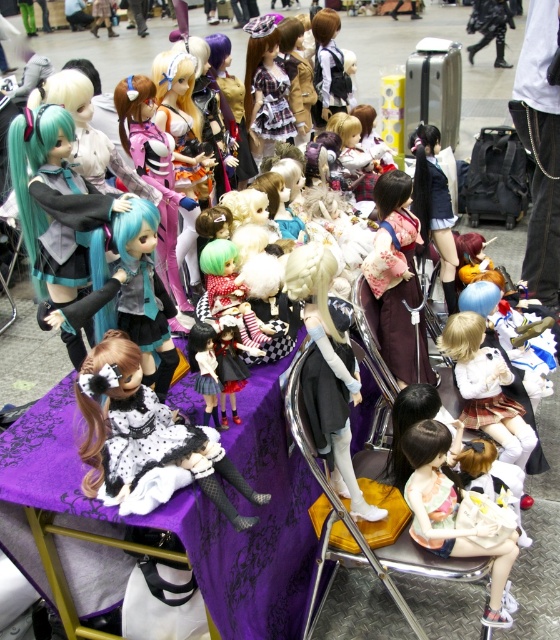
Does matte black dress at center appear under black leather boots at upper right?

Indeed, matte black dress at center is positioned under black leather boots at upper right.

Does matte black dress at center have a smaller size compared to black leather boots at upper right?

Indeed, matte black dress at center has a smaller size compared to black leather boots at upper right.

The image size is (560, 640). What do you see at coordinates (146, 440) in the screenshot?
I see `matte black dress at center` at bounding box center [146, 440].

I want to click on matte black dress at center, so click(x=146, y=440).

Consider the image. Who is higher up, teal matte wig at center or matte pink fabric doll at center?

teal matte wig at center

How much distance is there between teal matte wig at center and matte pink fabric doll at center?

teal matte wig at center is 1.60 meters from matte pink fabric doll at center.

Locate an element on the screen. The width and height of the screenshot is (560, 640). teal matte wig at center is located at coordinates (54, 202).

Does point (165, 456) come closer to viewer compared to point (488, 536)?

That is True.

Who is lower down, matte black dress at center or matte pink fabric doll at center?

Positioned lower is matte pink fabric doll at center.

Is point (128, 496) more distant than point (434, 484)?

No.

The image size is (560, 640). Find the location of `matte black dress at center`. matte black dress at center is located at coordinates (146, 440).